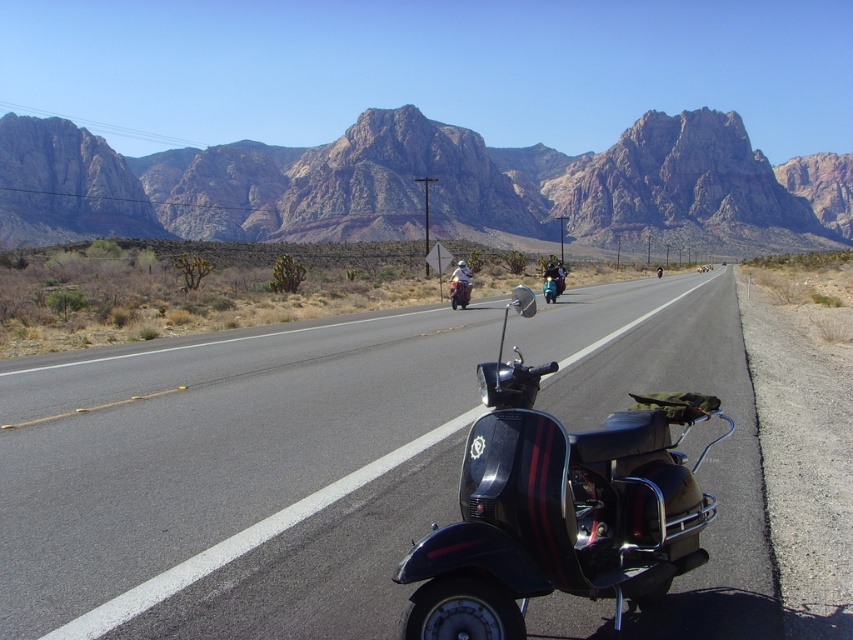
Can you confirm if black glossy scooter at center is smaller than white matte helmet at center?

Incorrect, black glossy scooter at center is not smaller in size than white matte helmet at center.

Can you confirm if black glossy scooter at center is positioned below white matte helmet at center?

Indeed, black glossy scooter at center is positioned under white matte helmet at center.

The image size is (853, 640). Identify the location of black glossy scooter at center. (236, 477).

Find the location of a particular element. The image size is (853, 640). black glossy scooter at center is located at coordinates (236, 477).

Does rugged rock formation at center appear on the right side of white matte helmet at center?

Indeed, rugged rock formation at center is positioned on the right side of white matte helmet at center.

Does point (370, 227) lie behind point (459, 268)?

Yes, point (370, 227) is behind point (459, 268).

The width and height of the screenshot is (853, 640). Identify the location of rugged rock formation at center. (408, 186).

Based on the photo, does black matte scooter at center have a greater height compared to matte black scooter at center?

Incorrect, black matte scooter at center's height is not larger of matte black scooter at center's.

Is black matte scooter at center to the right of matte black scooter at center from the viewer's perspective?

No, black matte scooter at center is not to the right of matte black scooter at center.

You are a GUI agent. You are given a task and a screenshot of the screen. Output one action in this format:
    pyautogui.click(x=<x>, y=<y>)
    Task: Click on the black matte scooter at center
    
    Given the screenshot: What is the action you would take?
    pyautogui.click(x=560, y=509)

The width and height of the screenshot is (853, 640). Identify the location of black matte scooter at center. (560, 509).